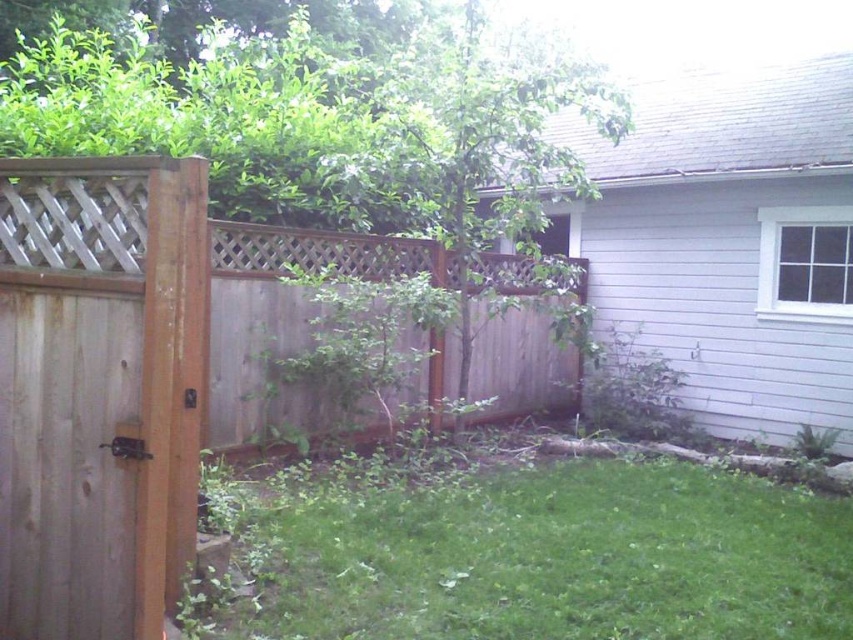
You are standing in front of the wooden fence and want to enter through the gate. Based on the scene, which object should you approach first to pass through the opening? The brown wood gate at left or the brown wood fence at left?

You should approach the brown wood gate at left first because it is positioned to the right of the brown wood fence at left, indicating it is the entrance point.